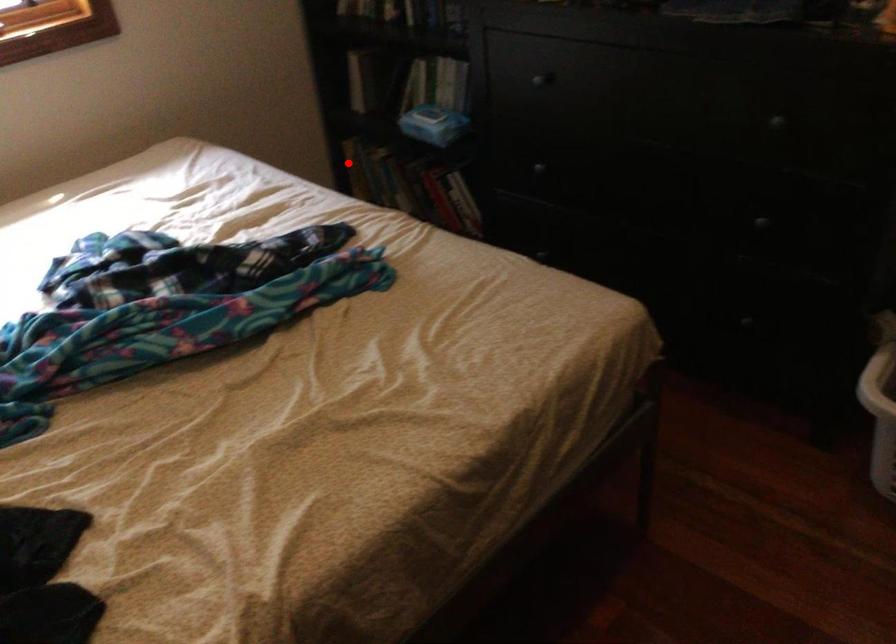
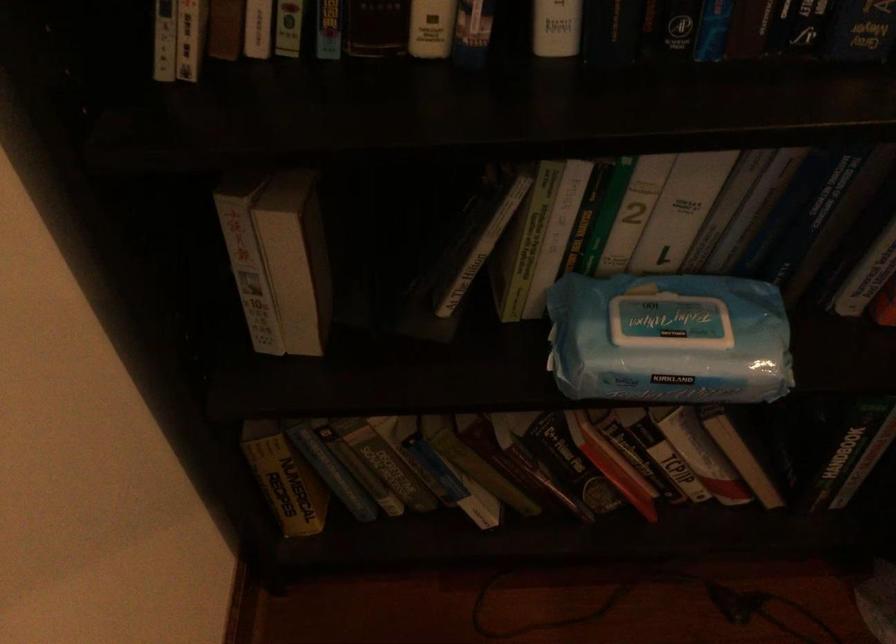
Question: I am providing you with two images of the same scene from different viewpoints. Image1 has a red point marked. In image2, the corresponding 3D location appears at what relative position? Reply with the corresponding letter.

Choices:
 (A) Closer
 (B) Farther

Answer: (A)